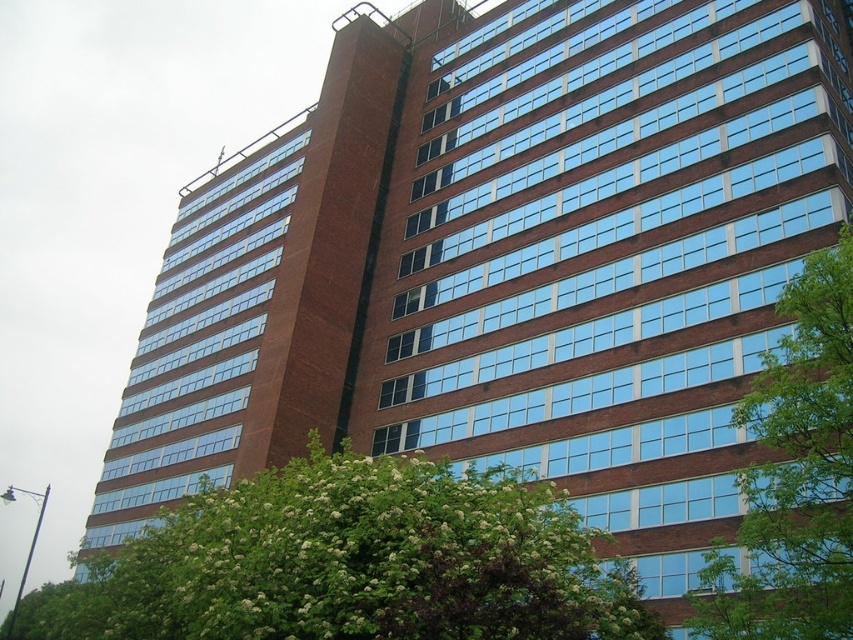
Between point (186, 627) and point (780, 410), which one is positioned in front?

Point (780, 410)

Between green leafy tree at lower left and green leafy tree at right, which one is positioned higher?

green leafy tree at right is higher up.

Locate an element on the screen. Image resolution: width=853 pixels, height=640 pixels. green leafy tree at lower left is located at coordinates (352, 563).